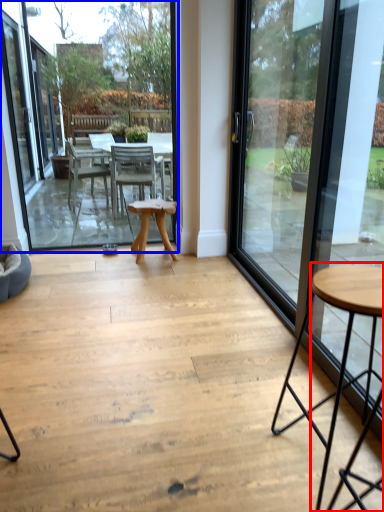
Question: Which object is closer to the camera taking this photo, coffee table (highlighted by a red box) or window screen (highlighted by a blue box)?

Choices:
 (A) coffee table
 (B) window screen

Answer: (A)